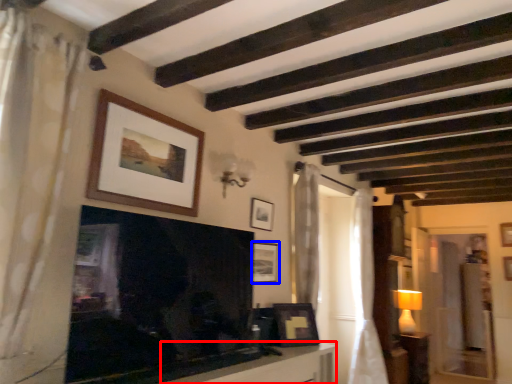
Question: Among these objects, which one is farthest to the camera, table (highlighted by a red box) or picture frame (highlighted by a blue box)?

Choices:
 (A) table
 (B) picture frame

Answer: (B)